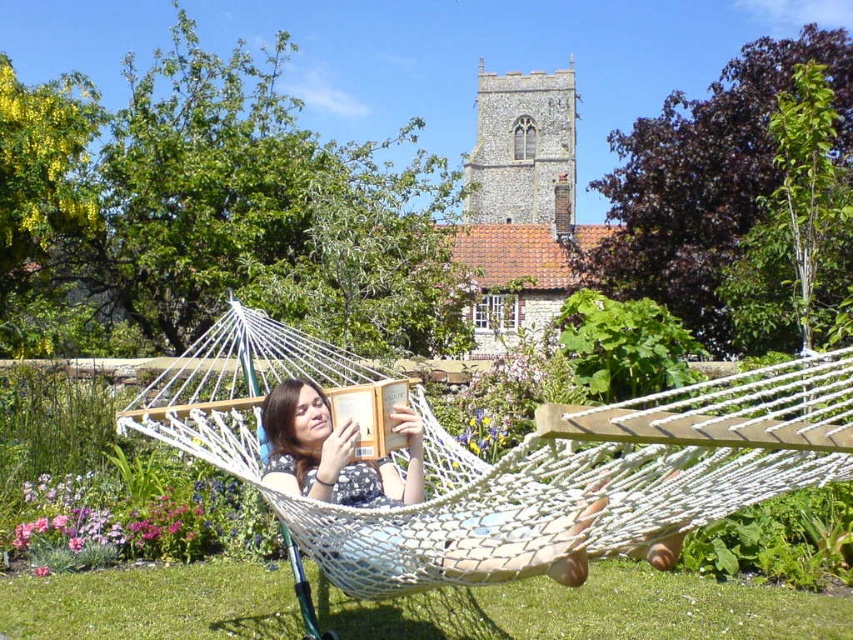
You are a photographer trying to capture the polka dot dress at center in the foreground. However, the white mesh hammock at center is blocking your view. Can you move the hammock to get a clear shot of the dress?

The white mesh hammock at center is positioned over polka dot dress at center, so moving the hammock would allow you to see the polka dot dress at center clearly.

You are standing in the outdoor area and want to place a small table between the white mesh hammock at center and the polka dot dress at center. Based on their positions, which object should the table be closer to?

The table should be placed closer to the polka dot dress at center because the white mesh hammock at center is to the left of the polka dot dress at center, meaning the dress is to the right of the hammock. Therefore, the table should be positioned between them with the dress being the closer object to the right side.